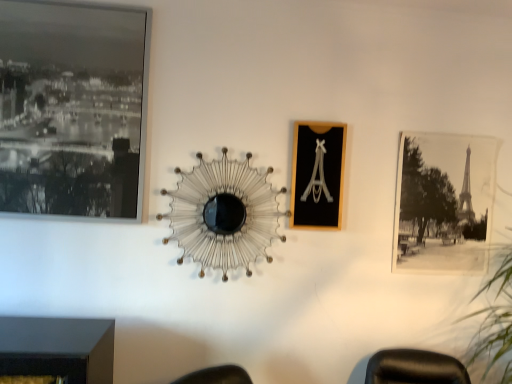
What do you see at coordinates (494, 317) in the screenshot?
I see `green leafy plant at right` at bounding box center [494, 317].

You are a GUI agent. You are given a task and a screenshot of the screen. Output one action in this format:
    pyautogui.click(x=<x>, y=<y>)
    Task: Click on the black paper photo at right, which appears as the 3th picture frame when viewed from the left
    The height and width of the screenshot is (384, 512).
    Given the screenshot: What is the action you would take?
    pos(444,202)

Measure the distance between point (283, 190) and camera.

A distance of 6.79 feet exists between point (283, 190) and camera.

Describe the element at coordinates (318, 175) in the screenshot. I see `black wood picture frame at center, the 2th picture frame from the front` at that location.

What do you see at coordinates (73, 110) in the screenshot? The width and height of the screenshot is (512, 384). I see `black glass picture frame at upper left, which ranks as the 1th picture frame in front-to-back order` at bounding box center [73, 110].

Image resolution: width=512 pixels, height=384 pixels. What are the coordinates of `green leafy plant at right` in the screenshot? It's located at (494, 317).

Which object is positioned more to the left, black paper photo at right, which ranks as the 1th picture frame in right-to-left order, or black glass picture frame at upper left, positioned as the 3th picture frame in back-to-front order?

black glass picture frame at upper left, positioned as the 3th picture frame in back-to-front order.

From the image's perspective, is black paper photo at right, the first picture frame from the back, below black glass picture frame at upper left, which ranks as the 1th picture frame in front-to-back order?

Yes.

Considering the relative sizes of black paper photo at right, which ranks as the 1th picture frame in right-to-left order, and black glass picture frame at upper left, positioned as the 3th picture frame in back-to-front order, in the image provided, is black paper photo at right, which ranks as the 1th picture frame in right-to-left order, shorter than black glass picture frame at upper left, positioned as the 3th picture frame in back-to-front order,?

Yes.

From a real-world perspective, count 2nd picture frames upward from the black paper photo at right, marked as the third picture frame in a front-to-back arrangement, and point to it. Please provide its 2D coordinates.

[(73, 110)]

From the image's perspective, which is above, black paper photo at right, which ranks as the 1th picture frame in right-to-left order, or green leafy plant at right?

From the image's view, black paper photo at right, which ranks as the 1th picture frame in right-to-left order, is above.

Is black paper photo at right, the first picture frame from the back, in contact with green leafy plant at right?

No, black paper photo at right, the first picture frame from the back, is not beside green leafy plant at right.

From a real-world perspective, is black paper photo at right, which appears as the 3th picture frame when viewed from the left, positioned above or below green leafy plant at right?

black paper photo at right, which appears as the 3th picture frame when viewed from the left, is above green leafy plant at right.

Based on their sizes in the image, would you say black paper photo at right, the first picture frame from the back, is bigger or smaller than green leafy plant at right?

Clearly, black paper photo at right, the first picture frame from the back, is smaller in size than green leafy plant at right.

From a real-world perspective, is black glass picture frame at upper left, which ranks as the 1th picture frame in front-to-back order, below black paper photo at right, which ranks as the 1th picture frame in right-to-left order?

No, from a real-world perspective, black glass picture frame at upper left, which ranks as the 1th picture frame in front-to-back order, is not under black paper photo at right, which ranks as the 1th picture frame in right-to-left order.

Based on the photo, who is more distant, black glass picture frame at upper left, positioned as the 3th picture frame in back-to-front order, or black paper photo at right, marked as the third picture frame in a front-to-back arrangement?

black paper photo at right, marked as the third picture frame in a front-to-back arrangement, is behind.

Which point is more distant from viewer, (17, 22) or (410, 254)?

The point (410, 254) is farther.

Which is behind, black glass picture frame at upper left, which ranks as the 1th picture frame in front-to-back order, or black wood picture frame at center, the 2th picture frame from the front?

black wood picture frame at center, the 2th picture frame from the front, is further from the camera.

Does point (9, 127) lie behind point (340, 187)?

No, it is not.

Looking at this image, can you confirm if black glass picture frame at upper left, marked as the first picture frame in a left-to-right arrangement, is wider than black wood picture frame at center, the 2th picture frame from the front?

Correct, the width of black glass picture frame at upper left, marked as the first picture frame in a left-to-right arrangement, exceeds that of black wood picture frame at center, the 2th picture frame from the front.

Is black glass picture frame at upper left, marked as the first picture frame in a left-to-right arrangement, taller or shorter than black wood picture frame at center, the second picture frame in the right-to-left sequence?

black glass picture frame at upper left, marked as the first picture frame in a left-to-right arrangement, is taller than black wood picture frame at center, the second picture frame in the right-to-left sequence.

From the image's perspective, is black paper photo at right, which ranks as the 1th picture frame in right-to-left order, above or below metallic wire at center?

black paper photo at right, which ranks as the 1th picture frame in right-to-left order, is above metallic wire at center.

Considering the relative positions of black paper photo at right, which ranks as the 1th picture frame in right-to-left order, and metallic wire at center in the image provided, is black paper photo at right, which ranks as the 1th picture frame in right-to-left order, in front of metallic wire at center?

No, black paper photo at right, which ranks as the 1th picture frame in right-to-left order, is further to the viewer.

Consider the image. Who is bigger, black paper photo at right, which ranks as the 1th picture frame in right-to-left order, or metallic wire at center?

metallic wire at center is bigger.

Which object is thinner, black paper photo at right, which ranks as the 1th picture frame in right-to-left order, or metallic wire at center?

Thinner between the two is black paper photo at right, which ranks as the 1th picture frame in right-to-left order.

Considering the relative positions of green leafy plant at right and black paper photo at right, which appears as the 3th picture frame when viewed from the left, in the image provided, is green leafy plant at right to the right of black paper photo at right, which appears as the 3th picture frame when viewed from the left, from the viewer's perspective?

Yes, green leafy plant at right is to the right of black paper photo at right, which appears as the 3th picture frame when viewed from the left.

Would you say green leafy plant at right is a long distance from black paper photo at right, which appears as the 3th picture frame when viewed from the left?

No, green leafy plant at right is not far from black paper photo at right, which appears as the 3th picture frame when viewed from the left.

Considering the sizes of objects green leafy plant at right and black paper photo at right, which appears as the 3th picture frame when viewed from the left, in the image provided, who is bigger, green leafy plant at right or black paper photo at right, which appears as the 3th picture frame when viewed from the left,?

With larger size is green leafy plant at right.

Is green leafy plant at right facing towards black paper photo at right, marked as the third picture frame in a front-to-back arrangement?

No, green leafy plant at right is not aimed at black paper photo at right, marked as the third picture frame in a front-to-back arrangement.

Is black wood picture frame at center, acting as the second picture frame starting from the back, surrounded by black paper photo at right, which appears as the 3th picture frame when viewed from the left?

No, black paper photo at right, which appears as the 3th picture frame when viewed from the left, does not contain black wood picture frame at center, acting as the second picture frame starting from the back.

In the scene shown: Does black paper photo at right, which ranks as the 1th picture frame in right-to-left order, have a greater height compared to black wood picture frame at center, placed as the 2th picture frame when sorted from left to right?

Indeed, black paper photo at right, which ranks as the 1th picture frame in right-to-left order, has a greater height compared to black wood picture frame at center, placed as the 2th picture frame when sorted from left to right.

Can you confirm if black paper photo at right, which ranks as the 1th picture frame in right-to-left order, is positioned to the right of black wood picture frame at center, the 2th picture frame from the front?

Indeed, black paper photo at right, which ranks as the 1th picture frame in right-to-left order, is positioned on the right side of black wood picture frame at center, the 2th picture frame from the front.

How different are the orientations of black paper photo at right, the first picture frame from the back, and black wood picture frame at center, placed as the 2th picture frame when sorted from left to right, in degrees?

0.00195 degrees.

Where is `the 2nd picture frame behind the black glass picture frame at upper left, the 3th picture frame positioned from the right, counting from the anchor's position`? This screenshot has width=512, height=384. the 2nd picture frame behind the black glass picture frame at upper left, the 3th picture frame positioned from the right, counting from the anchor's position is located at coordinates click(x=444, y=202).

Locate an element on the screen. This screenshot has height=384, width=512. plant on the right side of black paper photo at right, which appears as the 3th picture frame when viewed from the left is located at coordinates coord(494,317).

Looking at this image, estimate the real-world distances between objects in this image. Which object is further from black wood picture frame at center, the second picture frame in the right-to-left sequence, green leafy plant at right or metallic wire at center?

Among the two, green leafy plant at right is located further to black wood picture frame at center, the second picture frame in the right-to-left sequence.

Considering their positions, is metallic wire at center positioned further to black glass picture frame at upper left, positioned as the 3th picture frame in back-to-front order, than black wood picture frame at center, placed as the 2th picture frame when sorted from left to right?

Based on the image, black wood picture frame at center, placed as the 2th picture frame when sorted from left to right, appears to be further to black glass picture frame at upper left, positioned as the 3th picture frame in back-to-front order.

When comparing their distances from green leafy plant at right, does black glass picture frame at upper left, the 3th picture frame positioned from the right, or black wood picture frame at center, placed as the 2th picture frame when sorted from left to right, seem closer?

Among the two, black wood picture frame at center, placed as the 2th picture frame when sorted from left to right, is located nearer to green leafy plant at right.

When comparing their distances from black glass picture frame at upper left, which ranks as the 1th picture frame in front-to-back order, does black wood picture frame at center, the second picture frame in the right-to-left sequence, or metallic wire at center seem further?

Among the two, black wood picture frame at center, the second picture frame in the right-to-left sequence, is located further to black glass picture frame at upper left, which ranks as the 1th picture frame in front-to-back order.

Estimate the real-world distances between objects in this image. Which object is further from metallic wire at center, black wood picture frame at center, acting as the second picture frame starting from the back, or green leafy plant at right?

green leafy plant at right is further to metallic wire at center.

Which object lies further to the anchor point black glass picture frame at upper left, which ranks as the 1th picture frame in front-to-back order, black paper photo at right, marked as the third picture frame in a front-to-back arrangement, or metallic wire at center?

black paper photo at right, marked as the third picture frame in a front-to-back arrangement.

Considering their positions, is green leafy plant at right positioned closer to metallic wire at center than black glass picture frame at upper left, positioned as the 3th picture frame in back-to-front order?

Based on the image, black glass picture frame at upper left, positioned as the 3th picture frame in back-to-front order, appears to be nearer to metallic wire at center.

Looking at the image, which one is located further to green leafy plant at right, black paper photo at right, the first picture frame from the back, or black glass picture frame at upper left, positioned as the 3th picture frame in back-to-front order?

Among the two, black glass picture frame at upper left, positioned as the 3th picture frame in back-to-front order, is located further to green leafy plant at right.

You are a GUI agent. You are given a task and a screenshot of the screen. Output one action in this format:
    pyautogui.click(x=<x>, y=<y>)
    Task: Click on the mirror situated between black glass picture frame at upper left, which ranks as the 1th picture frame in front-to-back order, and black paper photo at right, which appears as the 3th picture frame when viewed from the left, from left to right
    The height and width of the screenshot is (384, 512).
    Given the screenshot: What is the action you would take?
    pyautogui.click(x=224, y=214)

The height and width of the screenshot is (384, 512). I want to click on picture frame between black glass picture frame at upper left, the 3th picture frame positioned from the right, and black paper photo at right, the first picture frame from the back, from left to right, so click(x=318, y=175).

At what (x,y) coordinates should I click in order to perform the action: click on picture frame located between black wood picture frame at center, the second picture frame in the right-to-left sequence, and green leafy plant at right in the left-right direction. Please return your answer as a coordinate pair (x, y). Looking at the image, I should click on (444, 202).

In order to click on mirror situated between black glass picture frame at upper left, positioned as the 3th picture frame in back-to-front order, and black wood picture frame at center, the 2th picture frame from the front, from left to right in this screenshot , I will do `click(224, 214)`.